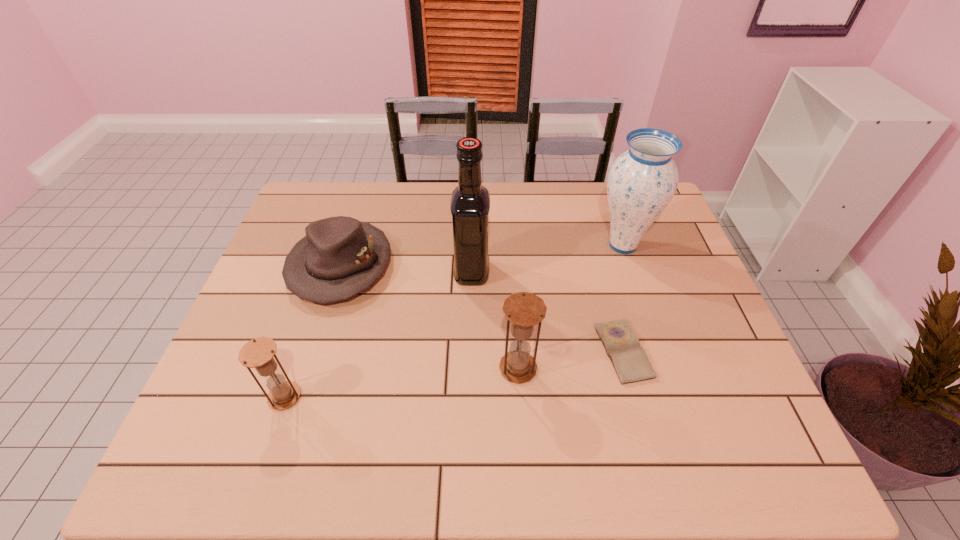
Please point a spot on the right to add another hourglass. Please provide its 2D coordinates. Your answer should be formatted as a tuple, i.e. [(x, y)], where the tuple contains the x and y coordinates of a point satisfying the conditions above.

[(730, 342)]